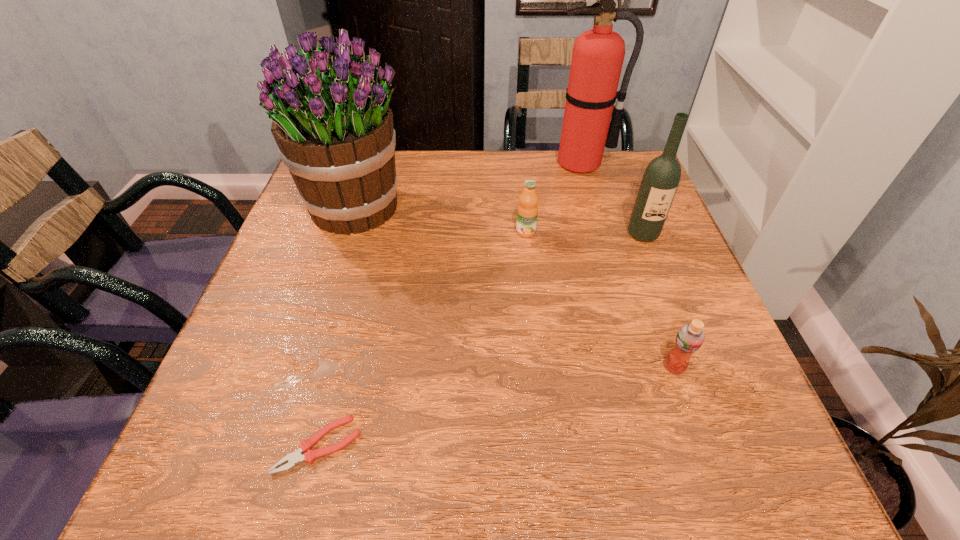
Identify the location of the farthest object. The height and width of the screenshot is (540, 960). (598, 54).

This screenshot has height=540, width=960. I want to click on bouquet, so click(x=331, y=120).

This screenshot has width=960, height=540. Identify the location of wine bottle. (660, 181).

I want to click on the third object from left to right, so click(x=527, y=212).

This screenshot has height=540, width=960. What are the coordinates of `the farther orange juice` in the screenshot? It's located at (527, 212).

At what (x,y) coordinates should I click in order to perform the action: click on the right orange juice. Please return your answer as a coordinate pair (x, y). Image resolution: width=960 pixels, height=540 pixels. Looking at the image, I should click on (690, 337).

Identify the location of the nearer orange juice. The height and width of the screenshot is (540, 960). [690, 337].

Locate an element on the screen. The image size is (960, 540). pliers is located at coordinates (309, 456).

Where is `the shortest object`? This screenshot has width=960, height=540. the shortest object is located at coordinates (309, 456).

Identify the location of free location located 0.380m at the nozzle of the fire extinguisher. (613, 274).